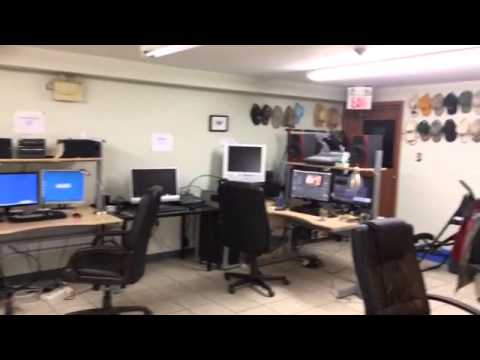
Find the location of `exit sign`. exit sign is located at coordinates (357, 95).